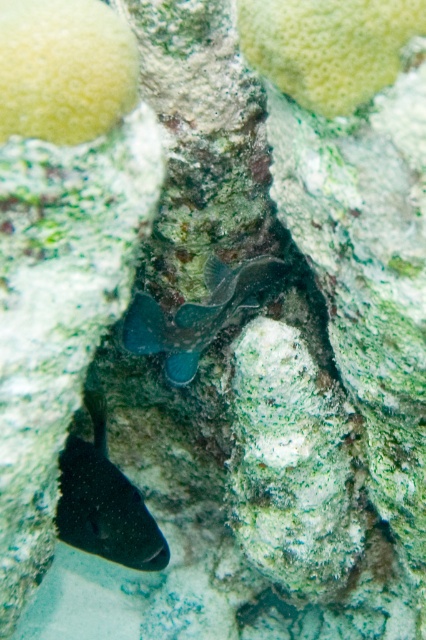
Looking at this image, you are a marine biologist observing an underwater scene. You notice a shiny black fish at lower left and a shiny blue fish at center. Which fish is wider?

The shiny blue fish at center is wider than the shiny black fish at lower left.

You are a marine biologist studying the coral reef. You notice two points marked in the image at coordinates point (71,451) and point (155,342). Which of these points is closer to the camera lens?

Point (71,451) is further to the camera than point (155,342). Therefore, point (155,342) is closer to the camera lens.

You are a marine biologist observing an underwater scene. You notice a shiny black fish at lower left and a shiny blue fish at center. Which fish is closer to the camera?

The shiny black fish at lower left is closer to the camera because the shiny blue fish at center is behind it.